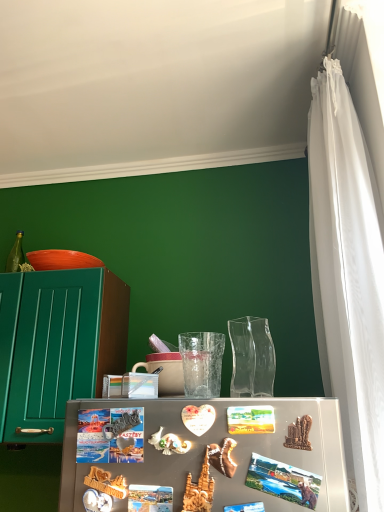
Question: Does transparent glass vase at center come in front of white sheer curtain at right?

Choices:
 (A) yes
 (B) no

Answer: (B)

Question: From a real-world perspective, is transparent glass vase at center under white sheer curtain at right?

Choices:
 (A) no
 (B) yes

Answer: (B)

Question: Does transparent glass vase at center have a lesser height compared to white sheer curtain at right?

Choices:
 (A) yes
 (B) no

Answer: (A)

Question: Considering the relative sizes of transparent glass vase at center and white sheer curtain at right in the image provided, is transparent glass vase at center smaller than white sheer curtain at right?

Choices:
 (A) no
 (B) yes

Answer: (B)

Question: Is white sheer curtain at right at the back of transparent glass vase at center?

Choices:
 (A) no
 (B) yes

Answer: (A)

Question: From the image's perspective, is transparent glass vase at center over white sheer curtain at right?

Choices:
 (A) yes
 (B) no

Answer: (B)

Question: Is white sheer curtain at right outside of metallic photo magnet at center?

Choices:
 (A) no
 (B) yes

Answer: (B)

Question: Does white sheer curtain at right have a greater width compared to metallic photo magnet at center?

Choices:
 (A) no
 (B) yes

Answer: (B)

Question: Can you confirm if white sheer curtain at right is taller than metallic photo magnet at center?

Choices:
 (A) no
 (B) yes

Answer: (B)

Question: Considering the relative positions of white sheer curtain at right and metallic photo magnet at center in the image provided, is white sheer curtain at right to the left of metallic photo magnet at center from the viewer's perspective?

Choices:
 (A) yes
 (B) no

Answer: (B)

Question: Is white sheer curtain at right turned away from metallic photo magnet at center?

Choices:
 (A) yes
 (B) no

Answer: (B)

Question: From a real-world perspective, is white sheer curtain at right positioned over metallic photo magnet at center based on gravity?

Choices:
 (A) yes
 (B) no

Answer: (A)

Question: Is matte ceramic mug at center to the right of transparent glass vase at center from the viewer's perspective?

Choices:
 (A) yes
 (B) no

Answer: (B)